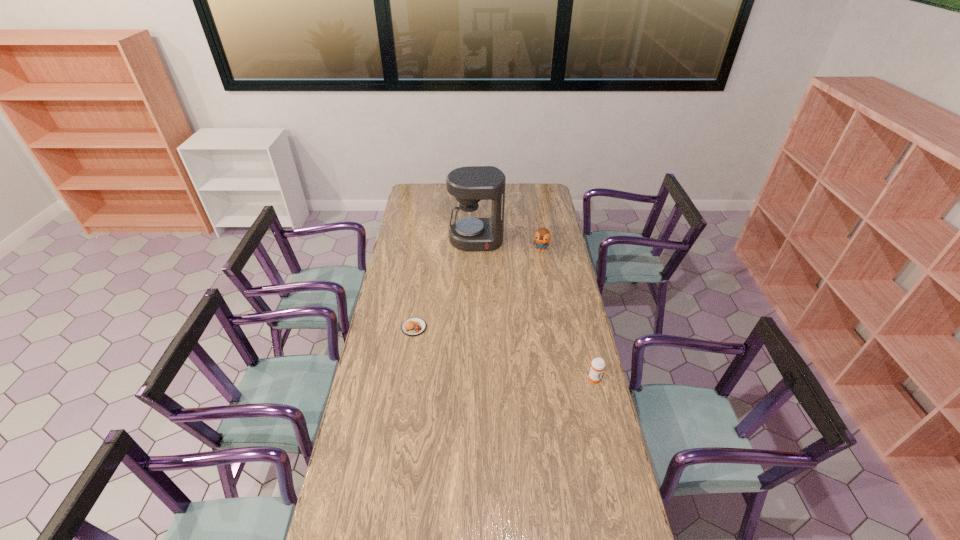
What are the coordinates of `free space between the duck and the third object from right to left` in the screenshot? It's located at (509, 245).

Where is `free spot between the third shortest object and the third object from right to left`? This screenshot has height=540, width=960. free spot between the third shortest object and the third object from right to left is located at coordinates (509, 245).

I want to click on free spot between the nearest object and the coffee maker, so click(x=535, y=309).

This screenshot has height=540, width=960. I want to click on the second closest object to the second object from left to right, so click(x=414, y=326).

The width and height of the screenshot is (960, 540). I want to click on the closest object to the coffee maker, so click(542, 236).

Identify the location of vacant space that satisfies the following two spatial constraints: 1. on the back side of the tallest object; 2. on the left side of the leftmost object. (427, 240).

At what (x,y) coordinates should I click in order to perform the action: click on vacant space that satisfies the following two spatial constraints: 1. on the front side of the patty; 2. on the right side of the third tallest object. Please return your answer as a coordinate pair (x, y). The width and height of the screenshot is (960, 540). Looking at the image, I should click on (406, 379).

Find the location of a particular element. free space that satisfies the following two spatial constraints: 1. on the back side of the second nearest object; 2. on the right side of the third object from left to right is located at coordinates (425, 251).